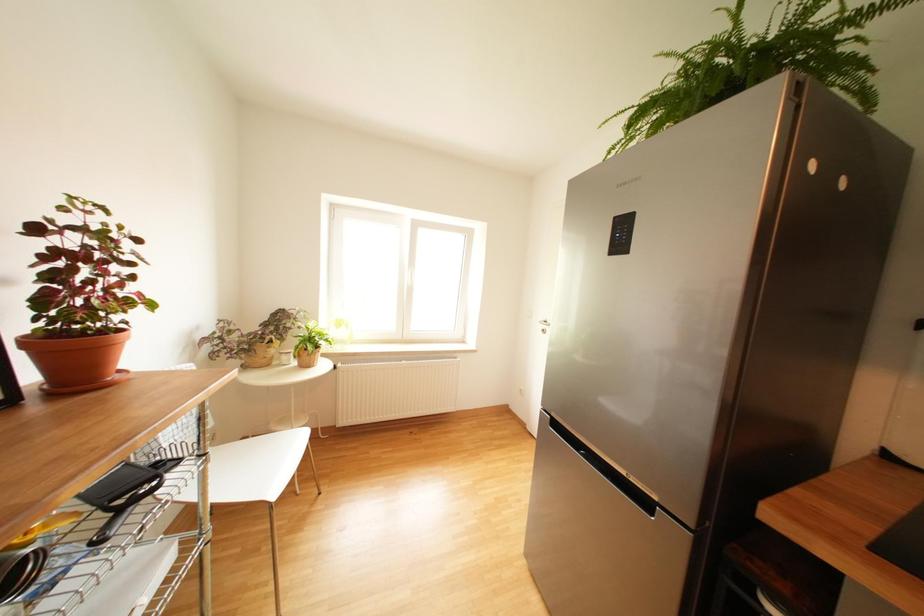
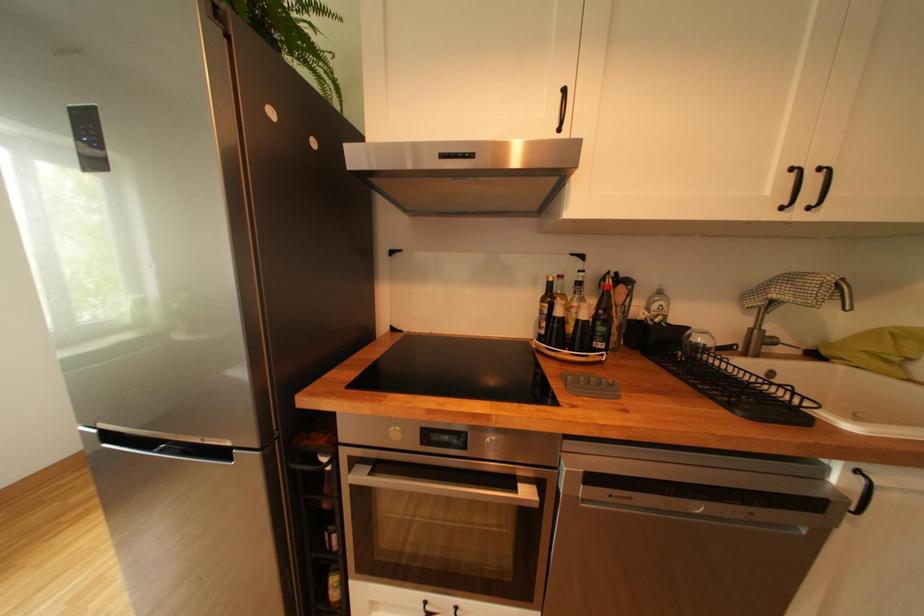
Question: The first image is from the beginning of the video and the second image is from the end. How did the camera likely rotate when shooting the video?

Choices:
 (A) Left
 (B) Right
 (C) Up
 (D) Down

Answer: (B)